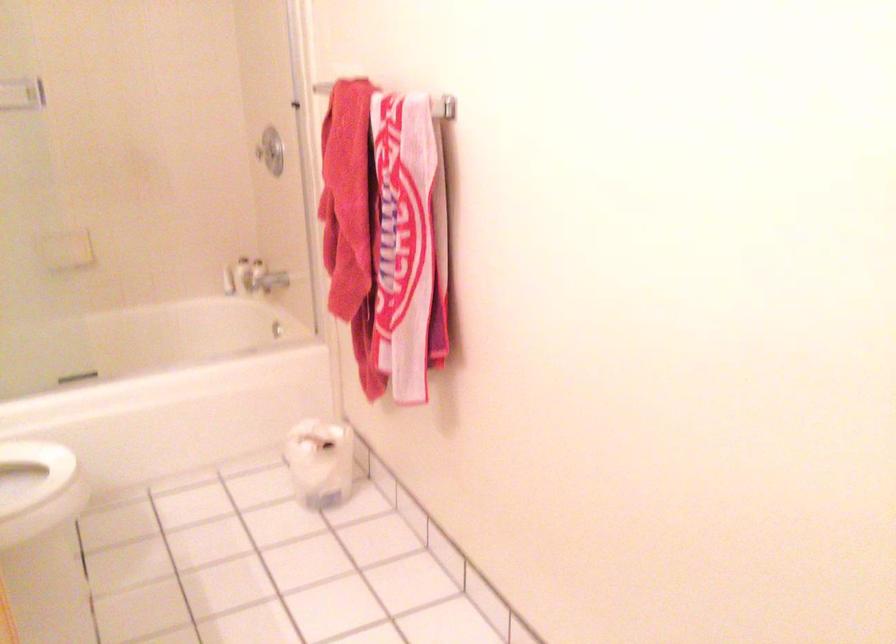
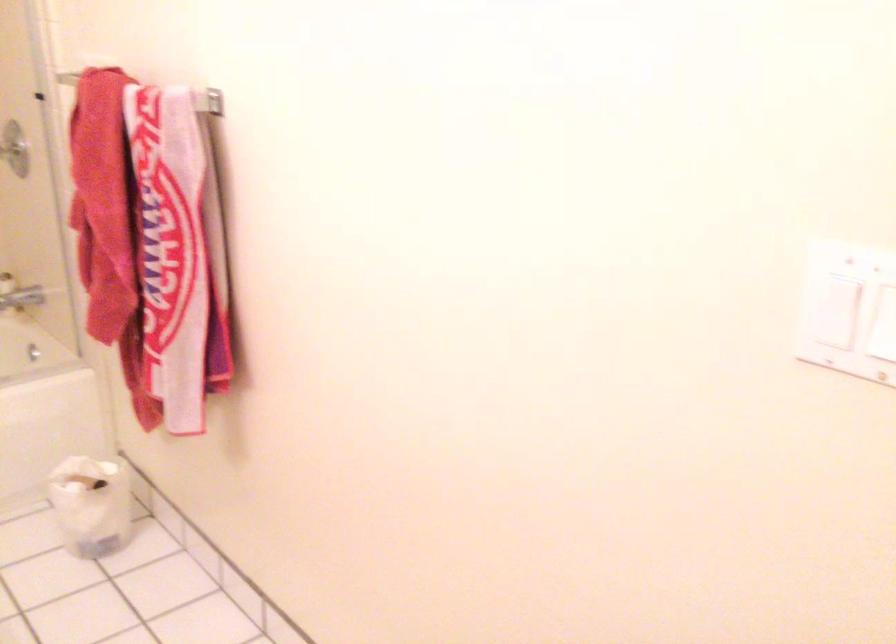
Find the pixel in the second image that matches (x=316, y=466) in the first image.

(90, 505)